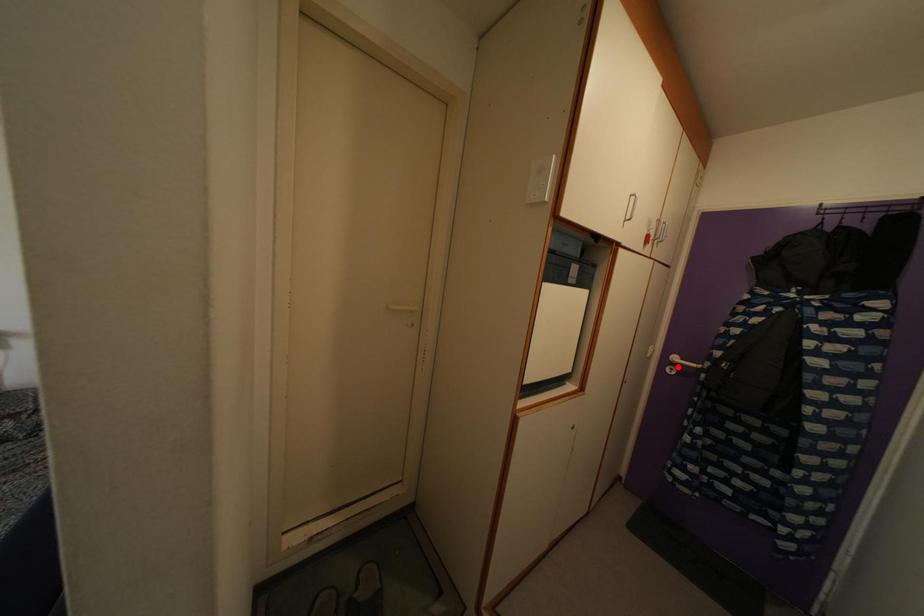
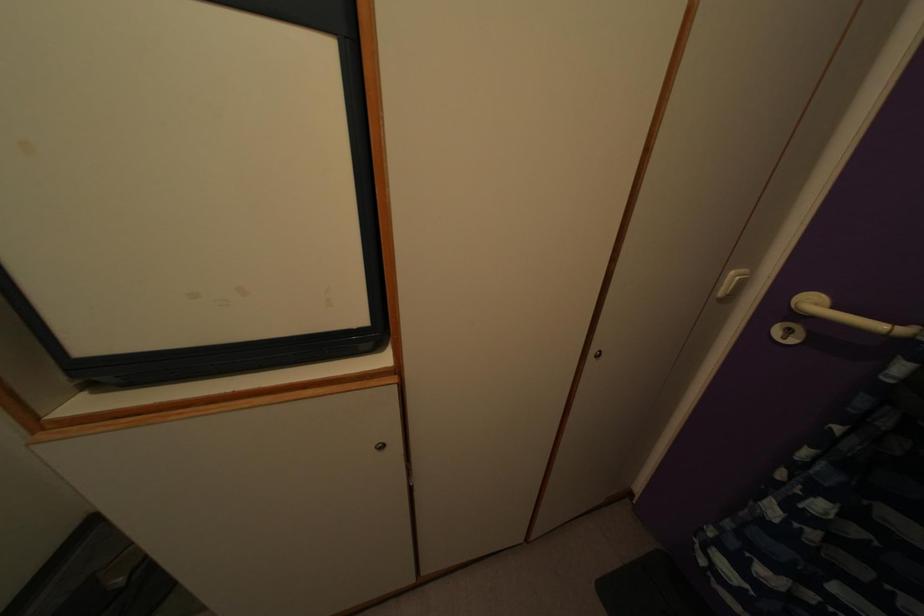
In the second image, find the point that corresponds to the highlighted location in the first image.

(815, 310)